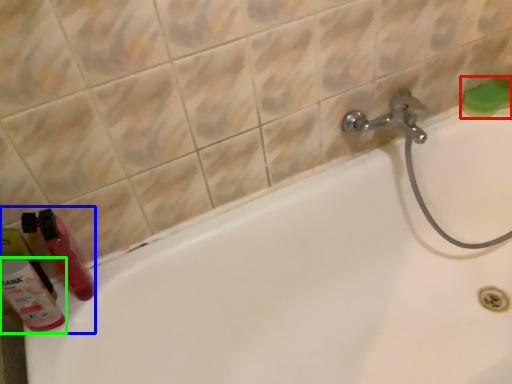
Question: Based on their relative distances, which object is nearer to soap (highlighted by a red box)? Choose from toiletry (highlighted by a blue box) and cleaning product (highlighted by a green box).

Choices:
 (A) toiletry
 (B) cleaning product

Answer: (A)